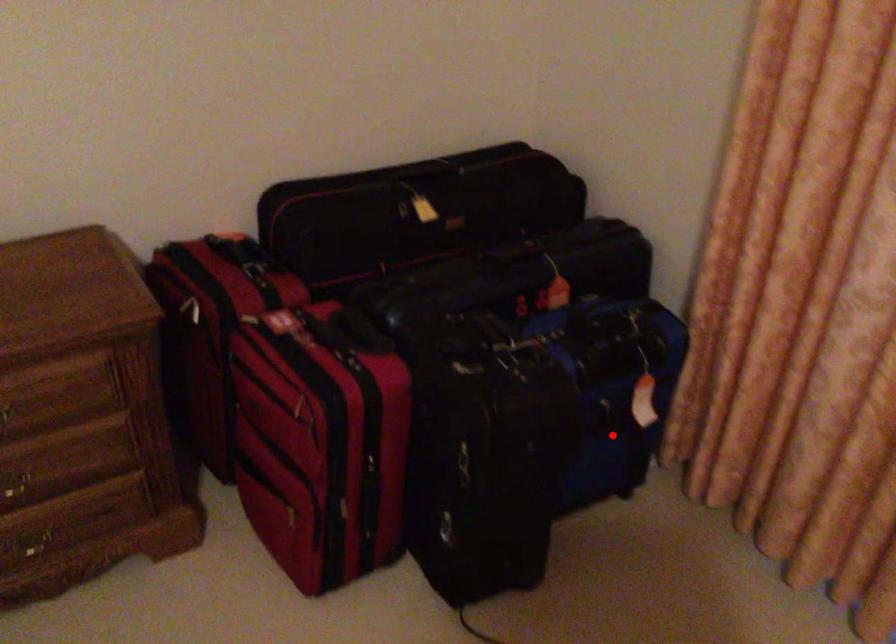
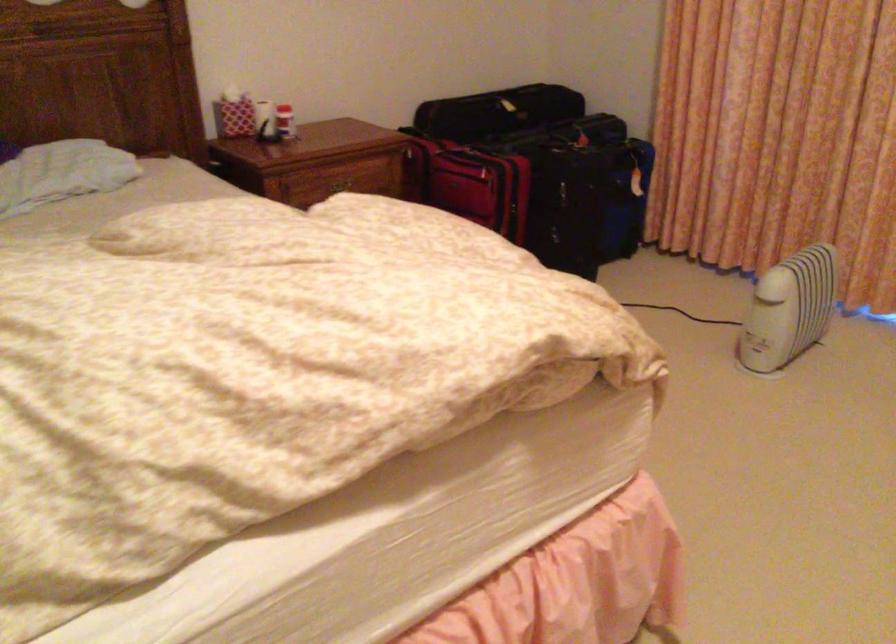
Question: I am providing you with two images of the same scene from different viewpoints. A red point is shown in image1. For the corresponding object point in image2, is it positioned nearer or farther from the camera?

Choices:
 (A) Nearer
 (B) Farther

Answer: (B)